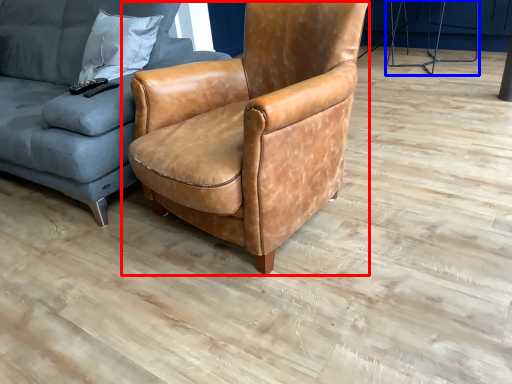
Question: Among these objects, which one is farthest to the camera, chair (highlighted by a red box) or half (highlighted by a blue box)?

Choices:
 (A) chair
 (B) half

Answer: (B)